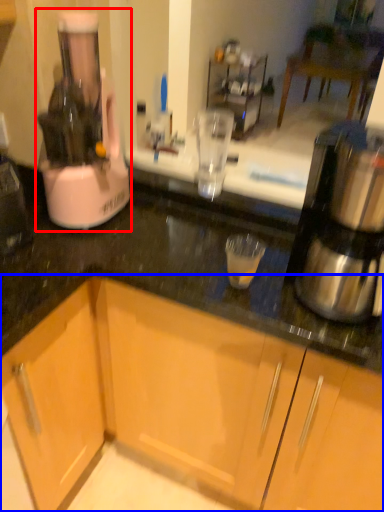
Question: Among these objects, which one is farthest to the camera, home appliance (highlighted by a red box) or cabinetry (highlighted by a blue box)?

Choices:
 (A) home appliance
 (B) cabinetry

Answer: (A)